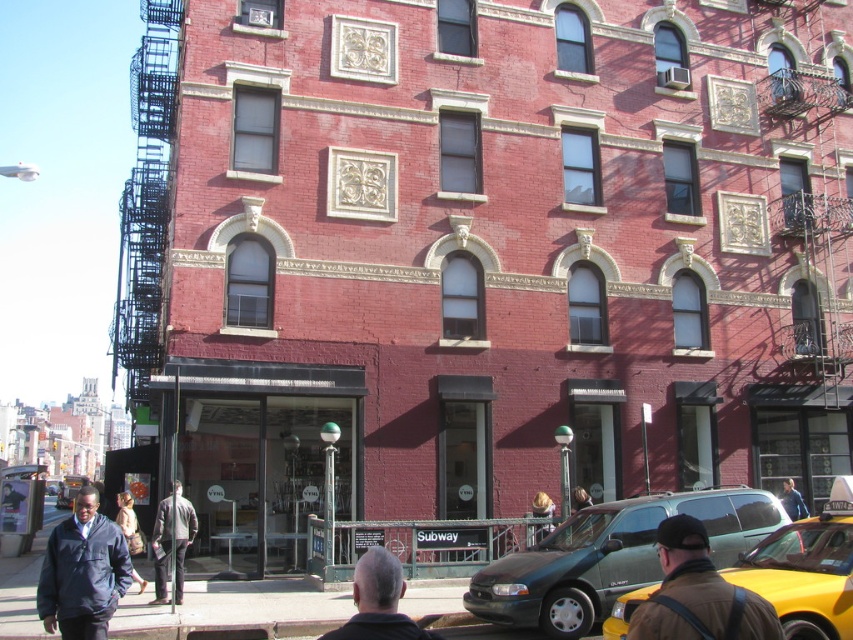
Question: Is yellow matte taxi at lower right positioned behind dark gray hair at center?

Choices:
 (A) no
 (B) yes

Answer: (B)

Question: Which point is farther to the camera?

Choices:
 (A) dark blue jacket at center
 (B) green matte van at center
 (C) yellow matte taxi at lower right
 (D) dark blue jacket at lower left

Answer: (A)

Question: Can you confirm if green matte van at center is thinner than yellow matte taxi at lower right?

Choices:
 (A) yes
 (B) no

Answer: (A)

Question: Among these objects, which one is farthest from the camera?

Choices:
 (A) dark gray jacket at center
 (B) yellow matte taxi at lower right
 (C) dark blue jacket at lower left
 (D) dark gray hair at center

Answer: (A)

Question: Estimate the real-world distances between objects in this image. Which object is closer to the yellow matte taxi at lower right?

Choices:
 (A) dark blue jacket at lower left
 (B) green matte van at center
 (C) dark blue jacket at center

Answer: (B)

Question: Can you confirm if dark blue jacket at lower left is thinner than dark gray hair at center?

Choices:
 (A) yes
 (B) no

Answer: (B)